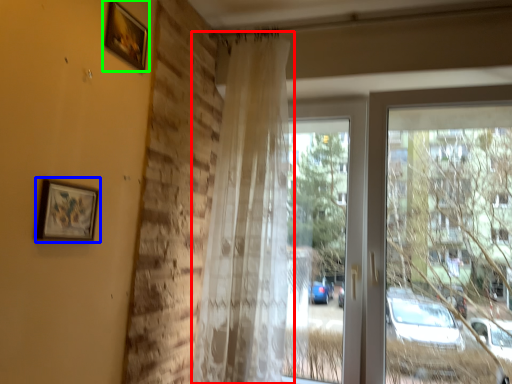
Question: Which object is positioned closest to curtain (highlighted by a red box)? Select from picture frame (highlighted by a blue box) and picture frame (highlighted by a green box).

Choices:
 (A) picture frame
 (B) picture frame

Answer: (B)